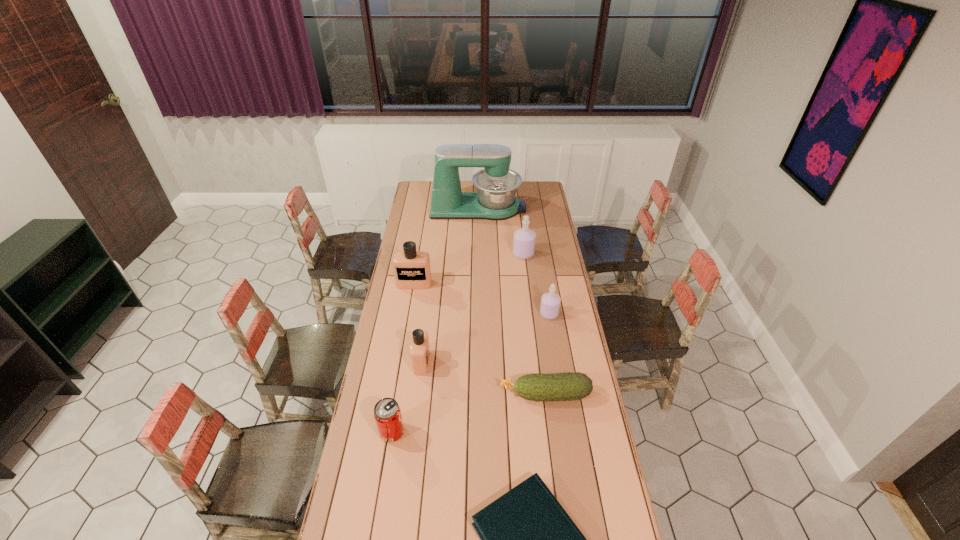
Where is `free location located at the blossom end of the cucumber`? The height and width of the screenshot is (540, 960). free location located at the blossom end of the cucumber is located at coordinates (418, 394).

At what (x,y) coordinates should I click in order to perform the action: click on vacant space situated 0.240m at the blossom end of the cucumber. Please return your answer as a coordinate pair (x, y). This screenshot has height=540, width=960. Looking at the image, I should click on (438, 394).

The height and width of the screenshot is (540, 960). In order to click on free region located 0.180m at the blossom end of the cucumber in this screenshot , I will do `click(454, 394)`.

Image resolution: width=960 pixels, height=540 pixels. Identify the location of object at the far edge. (496, 185).

You are a GUI agent. You are given a task and a screenshot of the screen. Output one action in this format:
    pyautogui.click(x=<x>, y=<y>)
    Task: Click on the mixer at the left edge
    
    Given the screenshot: What is the action you would take?
    [x=496, y=185]

Locate an element on the screen. pop soda that is positioned at the left edge is located at coordinates (387, 413).

At what (x,y) coordinates should I click in order to perform the action: click on mixer present at the right edge. Please return your answer as a coordinate pair (x, y). This screenshot has width=960, height=540. Looking at the image, I should click on (496, 185).

Locate an element on the screen. This screenshot has height=540, width=960. cucumber located at the right edge is located at coordinates (568, 386).

Find the location of a particular element. object positioned at the far left corner is located at coordinates (496, 185).

Where is `object at the far right corner`? object at the far right corner is located at coordinates (496, 185).